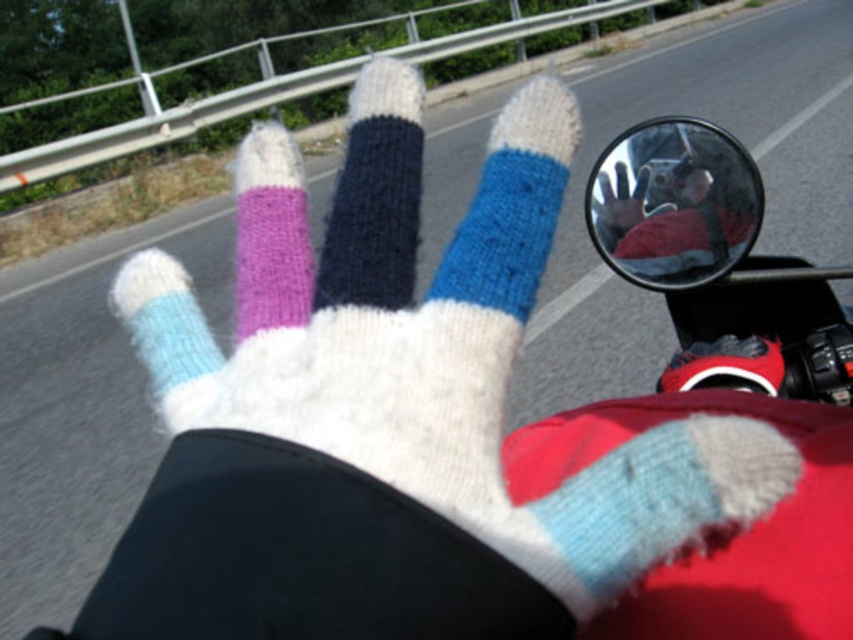
Is point (621, 166) positioned behind point (183, 358)?

Yes, it is.

Is clear glass mirror at upper right further to camera compared to white knitted sock at center?

That is False.

Who is more distant from viewer, (634,131) or (114,308)?

The point (114,308) is behind.

Image resolution: width=853 pixels, height=640 pixels. I want to click on clear glass mirror at upper right, so click(x=672, y=204).

Is point (376, 102) less distant than point (616, 193)?

Yes.

Between knitted wool sock at center and white knitted glove at center, which one appears on the right side from the viewer's perspective?

Positioned to the right is white knitted glove at center.

Is point (413, 225) positioned before point (614, 170)?

That is True.

Locate an element on the screen. knitted wool sock at center is located at coordinates (376, 193).

What are the coordinates of `knitted wool sock at center` in the screenshot? It's located at (376, 193).

Is knitted wool sock at center above purple knitted sock at center?

No, knitted wool sock at center is not above purple knitted sock at center.

I want to click on knitted wool sock at center, so click(376, 193).